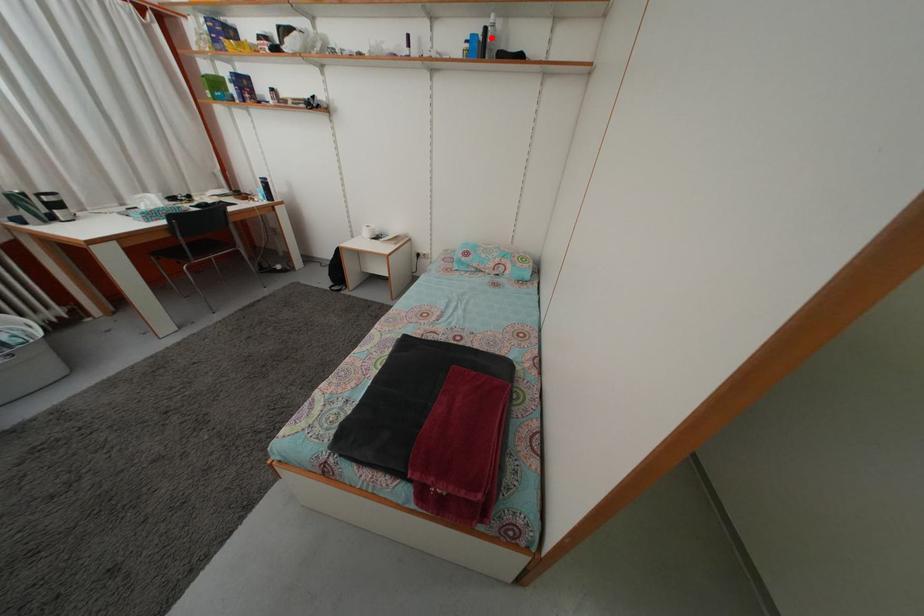
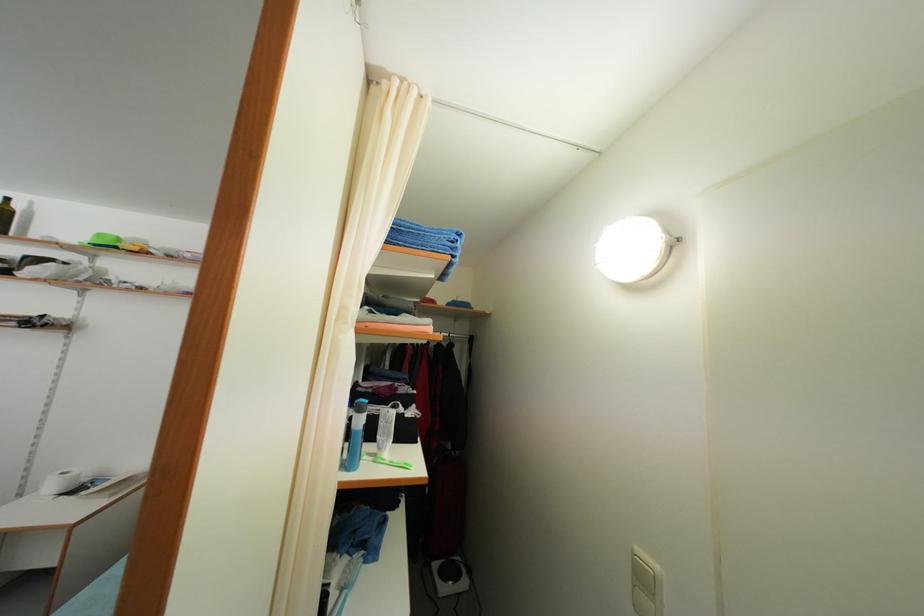
Question: I am providing you with two images of the same scene from different viewpoints. A red point is marked on the first image. Can you still see the location of the red point in image 2?

Choices:
 (A) Yes
 (B) No

Answer: (B)